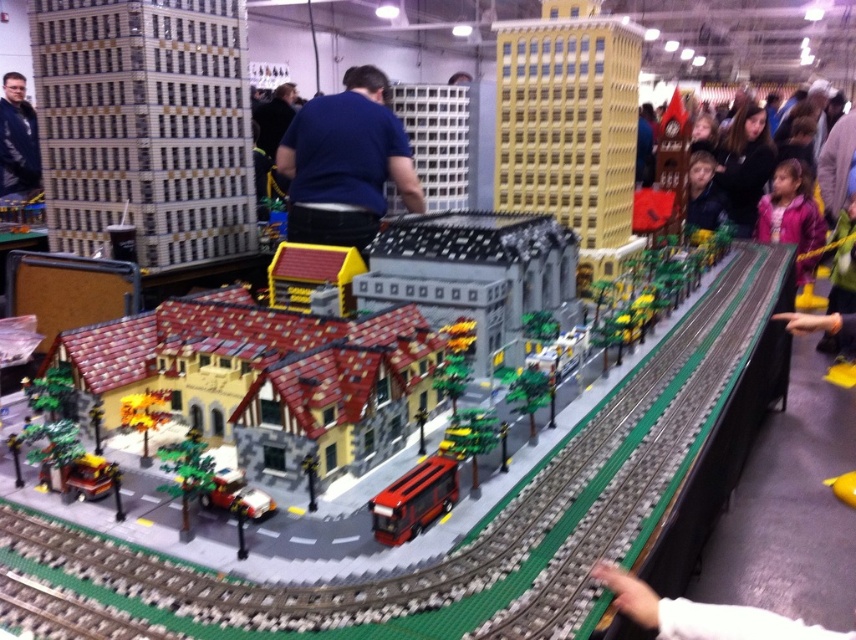
You are standing in front of the Lego cityscape display and notice a specific point at coordinates (345,163). Based on the scene description, what object is located at this point?

The point at coordinates (345,163) is on the blue fabric shirt at center.

You are a photographer at the Lego exhibition. You want to take a photo of the Lego cityscape so that the point at coordinate point (771, 180) is in focus. If your camera has a depth of field of 2 meters, will the entire Lego cityscape be in focus?

The distance between point (771, 180) and the camera is 3.90 meters. Since the depth of field is 2 meters, the range in focus would be from approximately 2.90 meters to 4.90 meters. The entire Lego cityscape is likely within this range, so yes, the entire scene should be in focus.